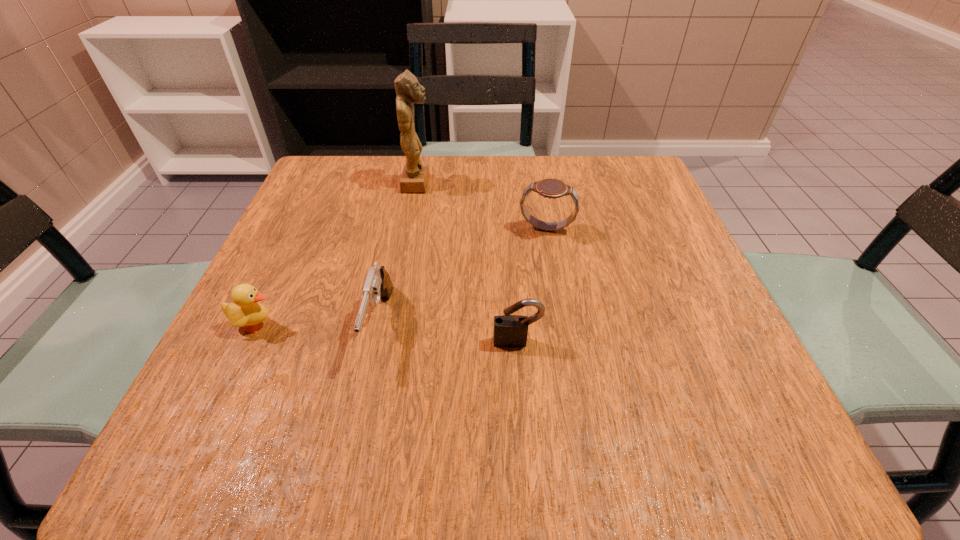
Locate an element on the screen. figurine is located at coordinates (415, 175).

At what (x,y) coordinates should I click in order to perform the action: click on the farthest object. Please return your answer as a coordinate pair (x, y). This screenshot has width=960, height=540. Looking at the image, I should click on [415, 175].

Where is `watch`? The image size is (960, 540). watch is located at coordinates (549, 188).

Find the location of a particular element. This screenshot has height=540, width=960. gun is located at coordinates 377,284.

Locate an element on the screen. The image size is (960, 540). padlock is located at coordinates (510, 331).

Locate an element on the screen. the leftmost object is located at coordinates [245, 311].

Where is `vacant space located on the front-facing side of the tallest object`? vacant space located on the front-facing side of the tallest object is located at coordinates tap(560, 183).

The height and width of the screenshot is (540, 960). Find the location of `vacant area located 0.140m on the front of the fourth nearest object`. vacant area located 0.140m on the front of the fourth nearest object is located at coordinates (557, 289).

Find the location of a particular element. This screenshot has height=540, width=960. free space located at the muzzle of the gun is located at coordinates (348, 469).

Where is `free location located with the keyhole on the front of the padlock`? The image size is (960, 540). free location located with the keyhole on the front of the padlock is located at coordinates (520, 386).